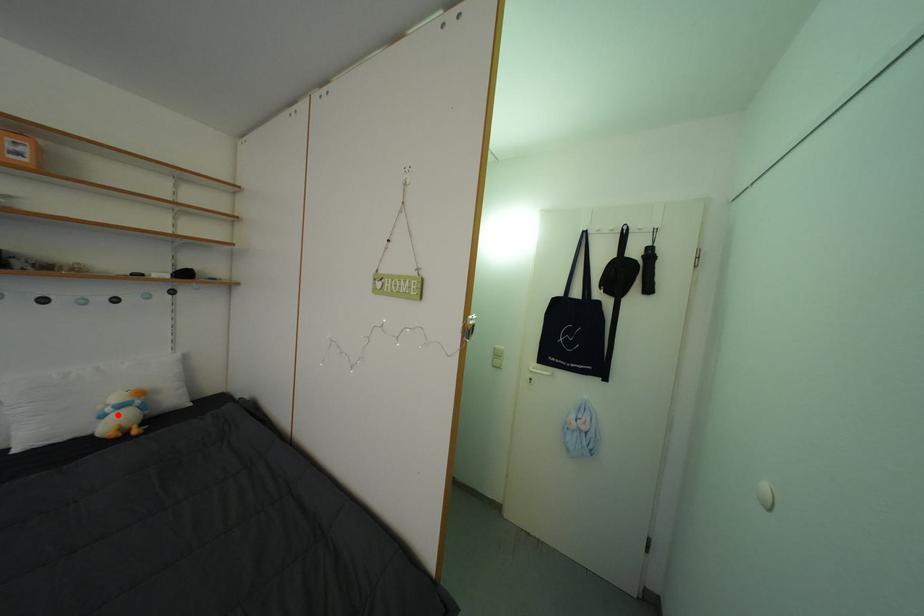
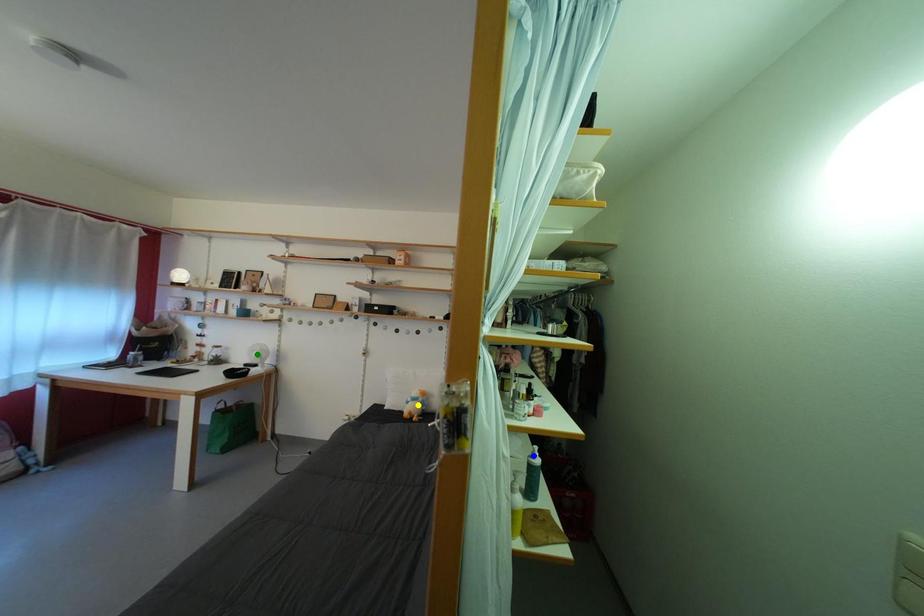
Question: I am providing you with two images of the same scene from different viewpoints. A red point is marked on the first image. You are given multiple points on the second image. Which spot in image 2 lines up with the point in image 1?

Choices:
 (A) blue point
 (B) yellow point
 (C) green point

Answer: (B)